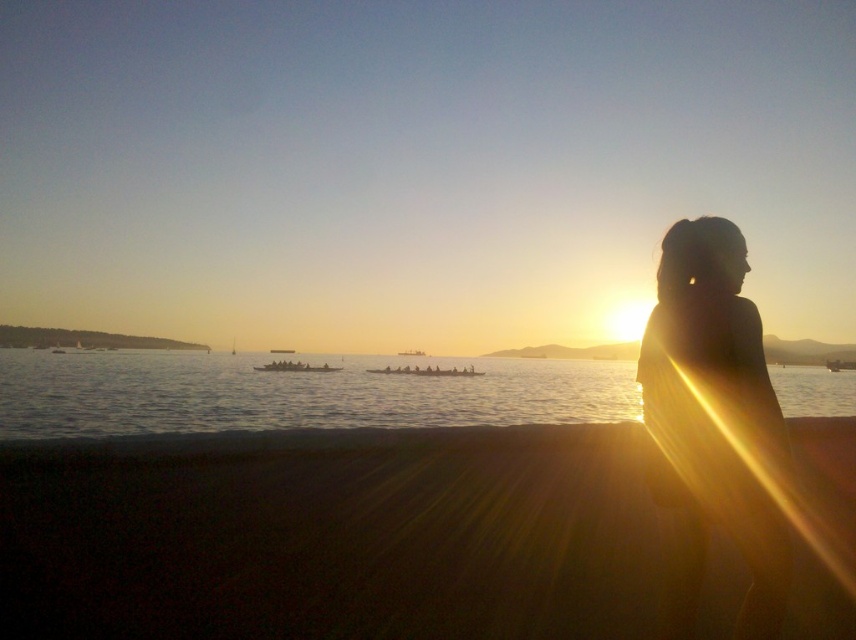
Question: Is dark sand at lower center bigger than silvery water at center?

Choices:
 (A) no
 (B) yes

Answer: (A)

Question: Is the position of silvery water at center more distant than that of silhouette hair at right?

Choices:
 (A) no
 (B) yes

Answer: (B)

Question: Can you confirm if dark sand at lower center is bigger than silvery water at center?

Choices:
 (A) yes
 (B) no

Answer: (B)

Question: Which object is farther from the camera taking this photo?

Choices:
 (A) silvery water at center
 (B) silhouette hair at right
 (C) dark sand at lower center

Answer: (A)

Question: Which of these objects is positioned closest to the silhouette hair at right?

Choices:
 (A) dark sand at lower center
 (B) silvery water at center

Answer: (A)

Question: Based on their relative distances, which object is nearer to the silvery water at center?

Choices:
 (A) dark sand at lower center
 (B) silhouette hair at right

Answer: (B)